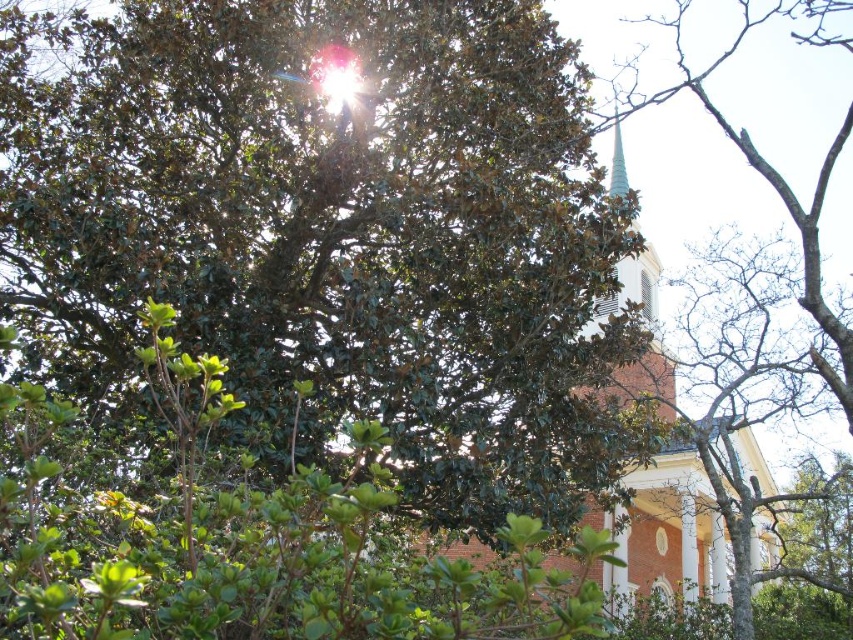
Based on the photo, you are an architect analyzing the spatial relationship between the white brick church at center and the green glass spire at upper center. Based on the scene provided, which object is located to the left of the other?

The white brick church at center is positioned on the right side of green glass spire at upper center, so the green glass spire at upper center is to the left of the white brick church at center.

Consider the image. You are standing in the middle of the forest and see the white brick church at center and the green glass spire at upper center. Which one is taller?

The white brick church at center has a greater height compared to the green glass spire at upper center, so the white brick church at center is taller.

You are standing in the middle of a park and see the white brick church at center and the green leafy tree at upper right. Which object is closer to your left side?

The white brick church at center is positioned on the left side of green leafy tree at upper right, so it is closer to your left side.